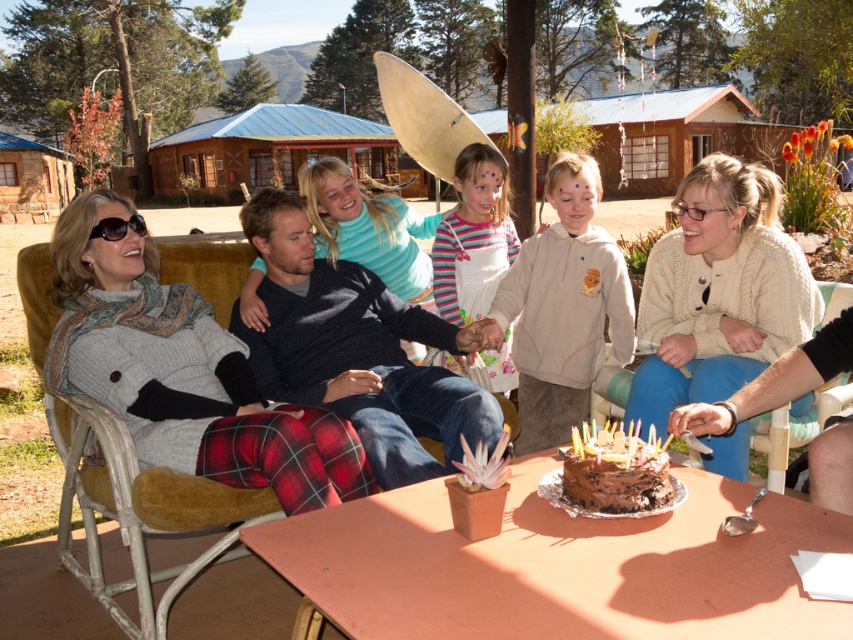
Question: Which point is farther to the camera?

Choices:
 (A) creamy knit sweater at center
 (B) matte gray sweater at center

Answer: (A)

Question: Estimate the real-world distances between objects in this image. Which object is farther from the wooden chair at lower right?

Choices:
 (A) creamy knit sweater at center
 (B) velvet yellow chair at left
 (C) chocolate frosted cake at center

Answer: (B)

Question: Does plaid fabric pants at left have a smaller size compared to matte gray sweater at center?

Choices:
 (A) no
 (B) yes

Answer: (B)

Question: Is light beige hoodie at center positioned before matte gray sweater at center?

Choices:
 (A) yes
 (B) no

Answer: (B)

Question: Which of the following is the farthest from the observer?

Choices:
 (A) (57, 227)
 (B) (780, 486)
 (C) (39, 342)

Answer: (B)

Question: Does dark blue sweater at center have a greater width compared to light beige hoodie at center?

Choices:
 (A) no
 (B) yes

Answer: (B)